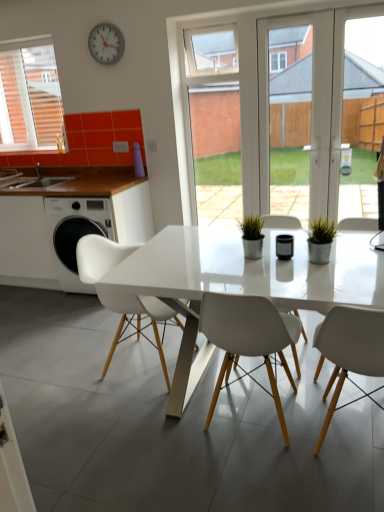
Locate an element on the screen. This screenshot has height=512, width=384. vacant space that is to the left of black glossy pen holder at center is located at coordinates (236, 261).